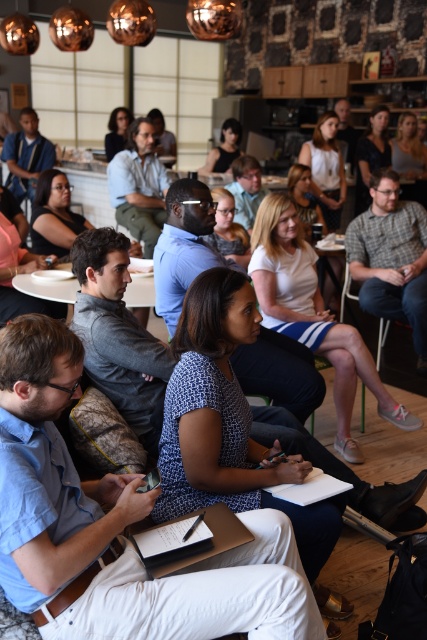
Consider the image. You are a photographer taking a picture of the scene. You notice the matte black laptop at left and the black fabric shirt at upper center. Which object is closer to the camera?

The black fabric shirt at upper center is closer to the camera because the matte black laptop at left is positioned under it, meaning the shirt is in front.

You are a photographer trying to capture a group photo of the matte blue shirt at upper left and the matte black shirt at center. If you want to ensure both shirts are fully visible in the frame, which shirt should you position closer to the camera to avoid cropping?

You should position the matte blue shirt at upper left closer to the camera because its width is larger than the matte black shirt at center, ensuring it fits within the frame without cropping.

You are a photographer trying to capture a candid shot of the black fabric shirt at upper center without the matte black laptop at left blocking the view. Can you position yourself in a way that the laptop is not in front of the shirt?

The matte black laptop at left has a lesser height compared to the black fabric shirt at upper center, so positioning yourself at an angle or slightly above the laptop level should allow you to capture the shirt without obstruction from the laptop.